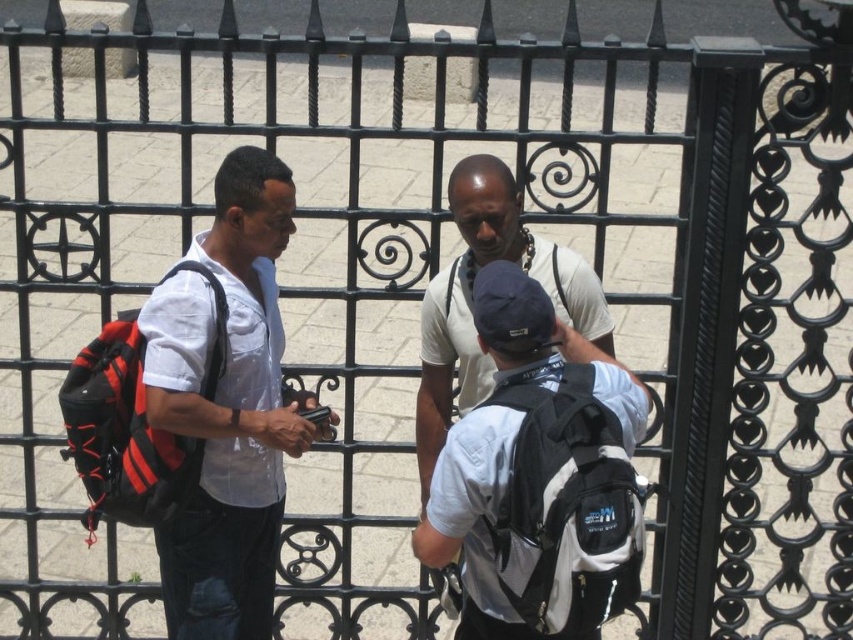
From the picture: You are a tour guide leading a group near an ornate black wrought iron gate. You notice two backpacks belonging to your tourists. The tourists are asking if their backpacks are positioned in a way that they can both easily access the gate entrance without blocking each other. Based on the scene description, can you confirm if the white matte backpack at center and the red and black fabric backpack at left are positioned in a way that allows both tourists to move freely towards the gate entrance?

The white matte backpack at center is to the right of the red and black fabric backpack at left. This means the red and black fabric backpack at left is positioned closer to the left side, while the white matte backpack at center is further to the right. Since they are placed apart from each other along the horizontal axis, both tourists can move towards the gate entrance without blocking each other.

You are standing at point (90, 355) and want to walk towards the ornate black wrought iron gate. Is the point (479, 362) behind you or in front of you?

The point (479, 362) is behind point (90, 355), so it is behind you.